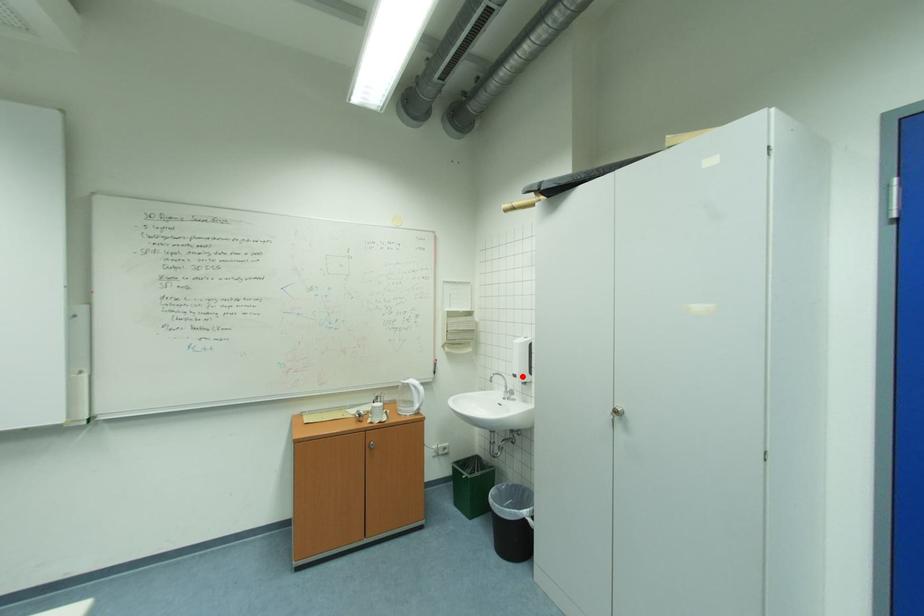
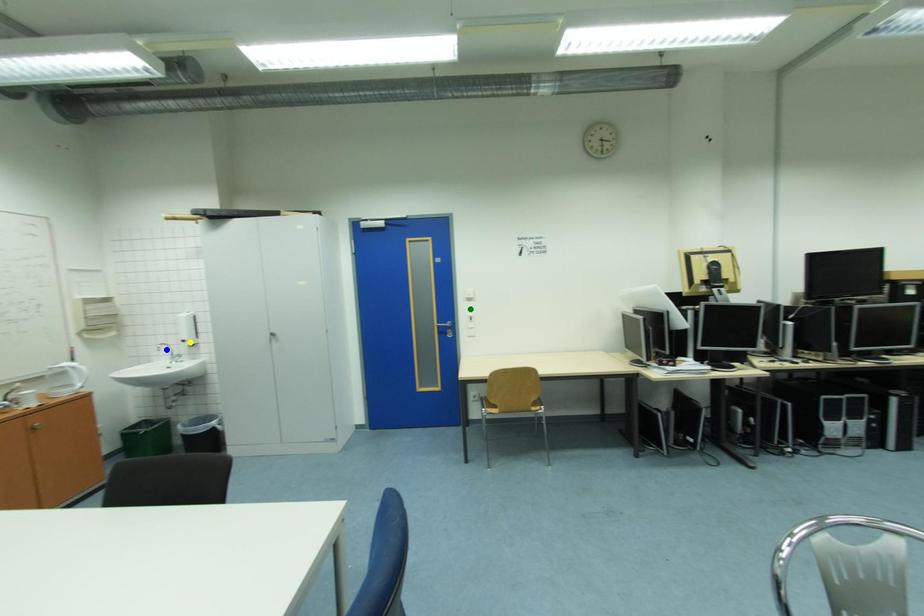
Question: I am providing you with two images of the same scene from different viewpoints. A red point is marked on the first image. You are given multiple points on the second image. Can you choose the point in image 2 that corresponds to the point in image 1?

Choices:
 (A) green point
 (B) yellow point
 (C) blue point

Answer: (B)